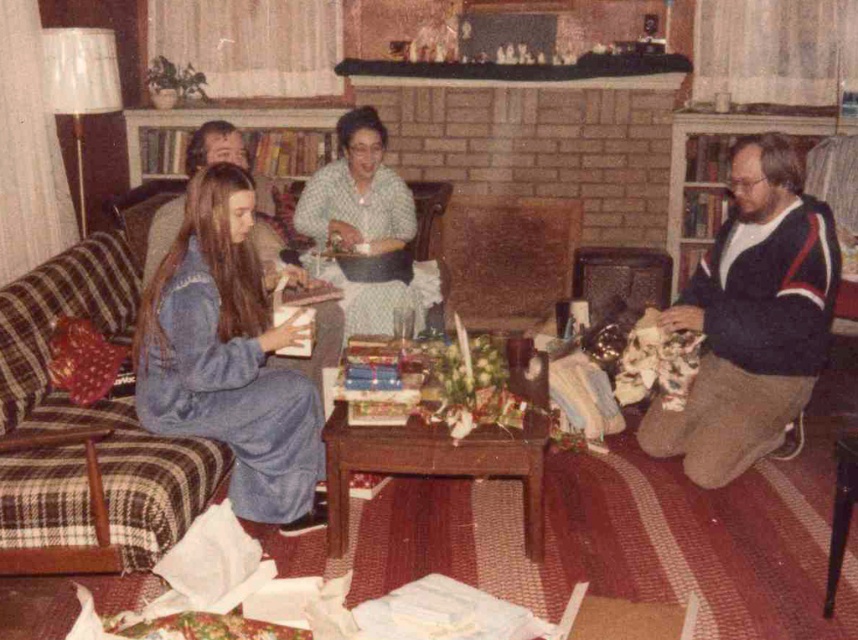
You are a guest entering the living room and see the plaid fabric couch at left and the denim tracksuit at left. Which one is more to the left?

The plaid fabric couch at left is more to the left.

You are standing in the living room and want to greet someone wearing the denim tracksuit at left and the blue knit sweater at center. Which person should you approach first if you want to greet the one closer to you?

You should approach the denim tracksuit at left first because it is in front of the blue knit sweater at center, meaning it is closer to you.

From the picture: You are a guest at this holiday gathering and want to sit down. You see the denim tracksuit at left and the blue knit sweater at center. Which one is taller?

The denim tracksuit at left is much taller than the blue knit sweater at center.